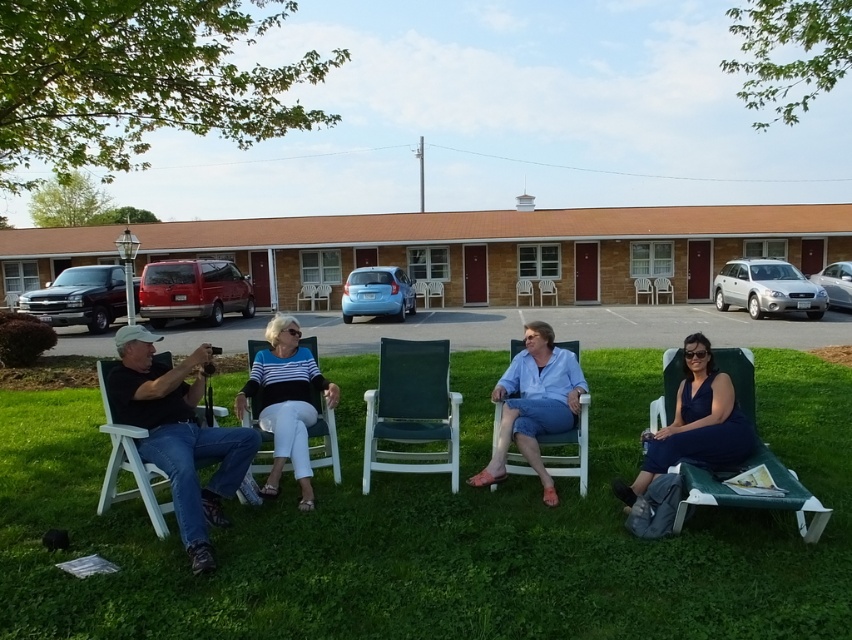
You are a photographer trying to capture a photo of the matte blue dress at lower right and the green plastic lounge chair at lower right. The camera you are using has a minimum focus distance of 12 inches. Can you focus on both objects without moving the camera?

The distance between the matte blue dress at lower right and the green plastic lounge chair at lower right is 11.77 inches, which is less than the camera minimum focus distance of 12 inches. Therefore, the camera cannot focus on both objects without moving closer.

Based on the photo, you are a photographer standing at the edge of the green grass at lower center. You want to take a photo of the white plastic chair at left without moving your position. Is the chair within your camera lens range if the maximum distance your camera can focus is 3.5 feet?

The distance between the green grass at lower center and the white plastic chair at left is 3.66 feet, which exceeds the camera lens range of 3.5 feet. Therefore, the chair will be out of focus.